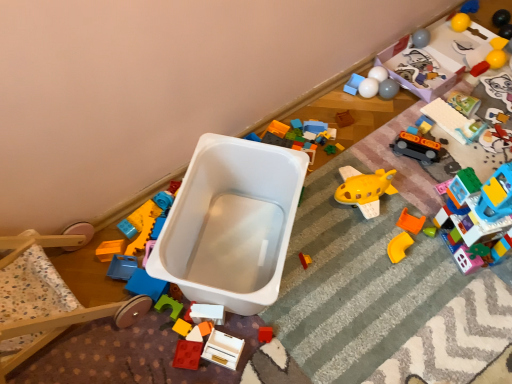
Locate an element on the screen. The image size is (512, 384). unoccupied region to the right of wooden toy box at center, arranged as the fourth toy when viewed from the left is located at coordinates (286, 340).